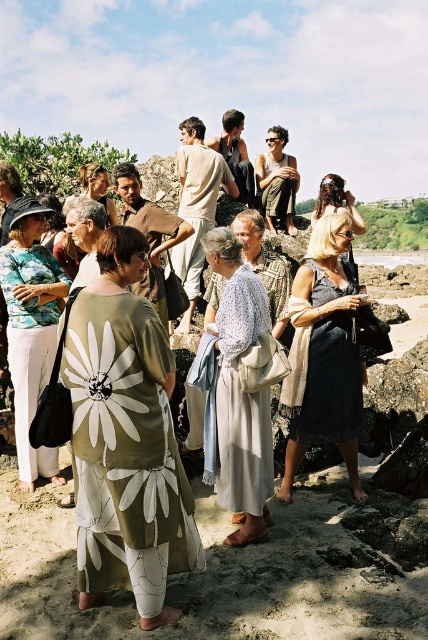
Between point (315, 321) and point (101, 164), which one is positioned in front?

Positioned in front is point (315, 321).

Is point (354, 394) positioned behind point (109, 204)?

That is False.

Identify the location of dark gray dress at center. (323, 355).

Between light beige cotton robe at center and green floral robe at center, which one has less height?

green floral robe at center is shorter.

Who is positioned more to the left, light beige cotton robe at center or green floral robe at center?

green floral robe at center is more to the left.

You are a GUI agent. You are given a task and a screenshot of the screen. Output one action in this format:
    pyautogui.click(x=<x>, y=<y>)
    Task: Click on the light beige cotton robe at center
    This screenshot has width=428, height=640.
    Given the screenshot: What is the action you would take?
    pyautogui.click(x=198, y=205)

Between blonde hair at center and dark gray cotton robe at center, which one is positioned lower?

Positioned lower is blonde hair at center.

Describe the element at coordinates (336, 202) in the screenshot. This screenshot has height=640, width=428. I see `blonde hair at center` at that location.

The height and width of the screenshot is (640, 428). I want to click on blonde hair at center, so click(336, 202).